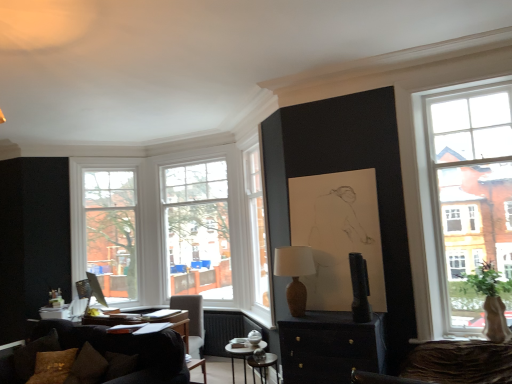
Question: Can you confirm if metallic silver side table at center is bigger than green leafy plant at right?

Choices:
 (A) no
 (B) yes

Answer: (A)

Question: Can you confirm if metallic silver side table at center is smaller than green leafy plant at right?

Choices:
 (A) no
 (B) yes

Answer: (B)

Question: From a real-world perspective, is metallic silver side table at center on top of green leafy plant at right?

Choices:
 (A) no
 (B) yes

Answer: (A)

Question: Are metallic silver side table at center and green leafy plant at right far apart?

Choices:
 (A) yes
 (B) no

Answer: (A)

Question: Could you tell me if metallic silver side table at center is facing green leafy plant at right?

Choices:
 (A) no
 (B) yes

Answer: (A)

Question: From the image's perspective, is metallic silver side table at center below green leafy plant at right?

Choices:
 (A) yes
 (B) no

Answer: (A)

Question: From a real-world perspective, is clear glass window at center, which is the 2th window from left to right, under dark brown fabric couch at lower left?

Choices:
 (A) yes
 (B) no

Answer: (B)

Question: Can you see clear glass window at center, which is the 2th window from left to right, touching dark brown fabric couch at lower left?

Choices:
 (A) yes
 (B) no

Answer: (B)

Question: From the image's perspective, is clear glass window at center, which ranks as the 1th window in right-to-left order, below dark brown fabric couch at lower left?

Choices:
 (A) no
 (B) yes

Answer: (A)

Question: Considering the relative positions of clear glass window at center, which is the 2th window from left to right, and dark brown fabric couch at lower left in the image provided, is clear glass window at center, which is the 2th window from left to right, behind dark brown fabric couch at lower left?

Choices:
 (A) yes
 (B) no

Answer: (A)

Question: Is clear glass window at center, which is the 2th window from left to right, closer to the viewer compared to dark brown fabric couch at lower left?

Choices:
 (A) no
 (B) yes

Answer: (A)

Question: From a real-world perspective, is clear glass window at center, which is the 2th window from left to right, located higher than dark brown fabric couch at lower left?

Choices:
 (A) no
 (B) yes

Answer: (B)

Question: Considering the relative sizes of matte brown vase at center and metallic silver side table at center in the image provided, is matte brown vase at center bigger than metallic silver side table at center?

Choices:
 (A) no
 (B) yes

Answer: (A)